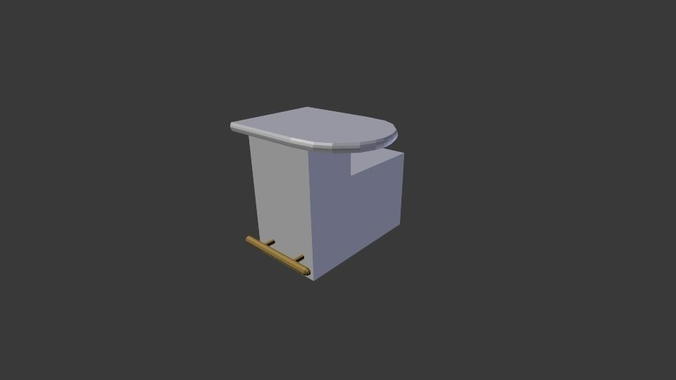
Find the location of a particular element. This screenshot has height=380, width=676. corner is located at coordinates (232, 127).